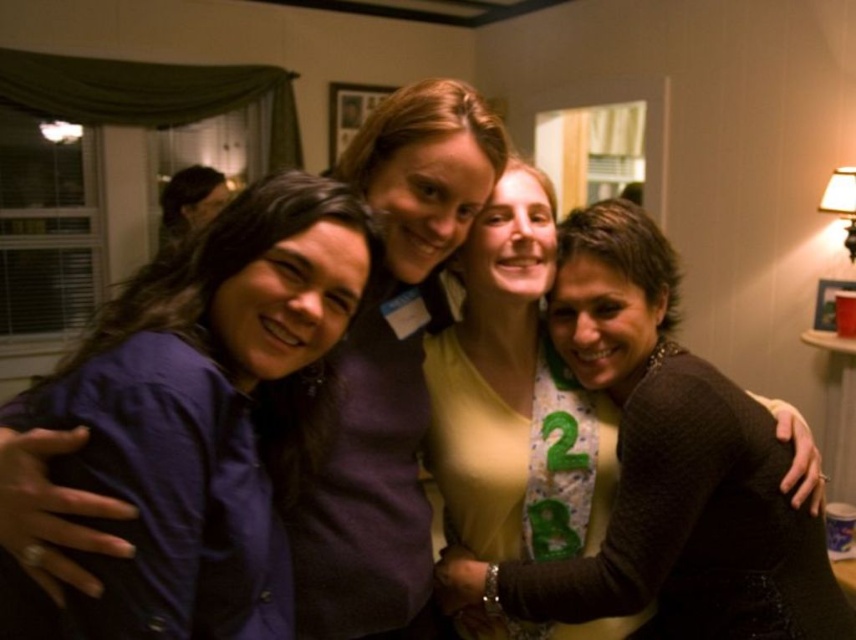
Consider the image. What is the color of the shirt worn by the woman standing at the coordinate point (205,419) in the image?

The dark blue shirt at left is located at point (205,419), so the color is dark blue.

You are trying to decide which clothing item to purchase between the dark blue shirt at left and the matte brown sweater at center. Based on their sizes in the image, which one would you choose if you want the larger one?

The matte brown sweater at center is larger than the dark blue shirt at left, so you should choose the matte brown sweater at center if you want the larger one.